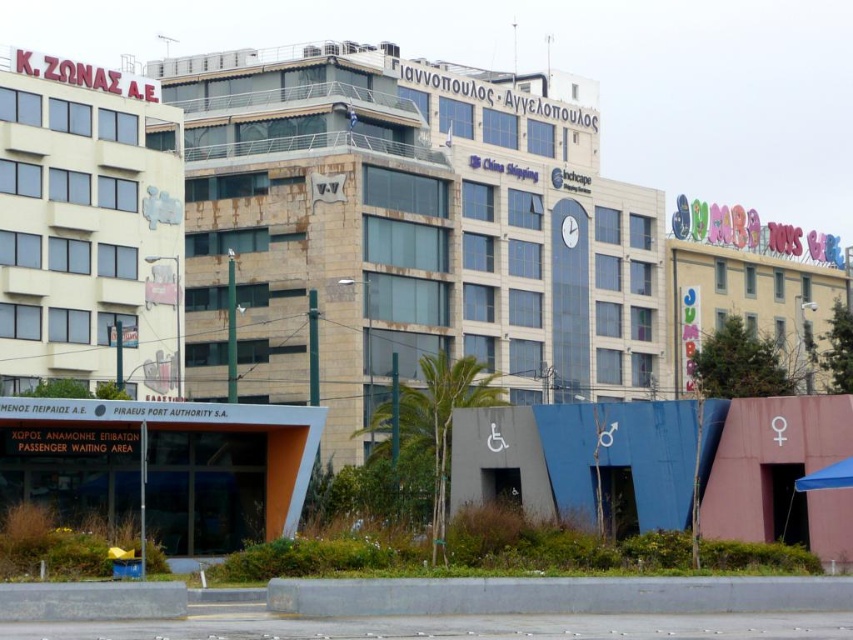
Question: Which point is closer to the camera?

Choices:
 (A) (80, 125)
 (B) (386, 220)
 (C) (766, 323)

Answer: (A)

Question: Among these objects, which one is nearest to the camera?

Choices:
 (A) beige concrete building at left
 (B) rustic stone building at center
 (C) pastel painted building at right

Answer: (C)

Question: Can you confirm if rustic stone building at center is thinner than pastel painted building at right?

Choices:
 (A) yes
 (B) no

Answer: (B)

Question: Is beige concrete building at left above pastel painted building at right?

Choices:
 (A) yes
 (B) no

Answer: (A)

Question: Is beige concrete building at left below pastel painted building at right?

Choices:
 (A) no
 (B) yes

Answer: (A)

Question: Considering the real-world distances, which object is closest to the beige concrete building at left?

Choices:
 (A) pastel painted building at right
 (B) rustic stone building at center

Answer: (B)